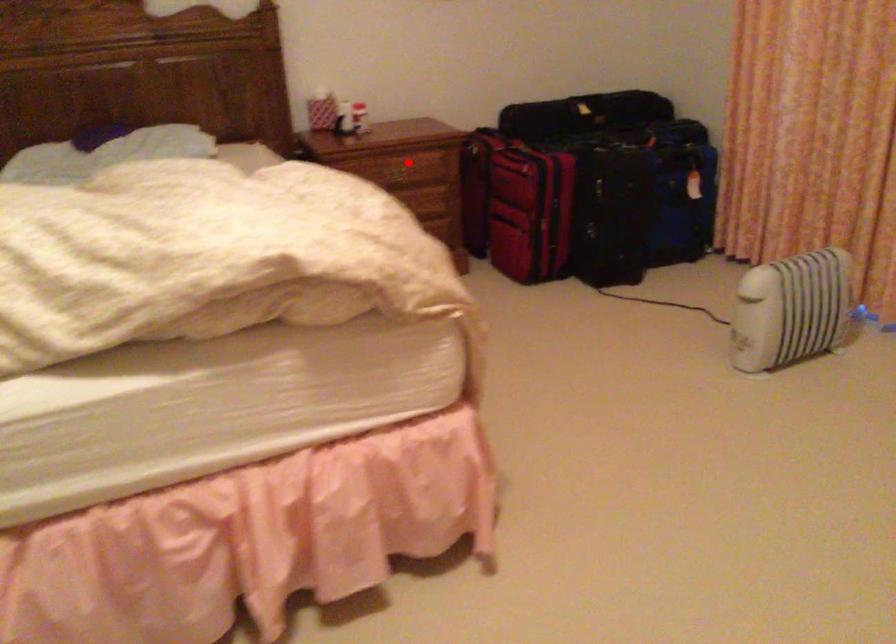
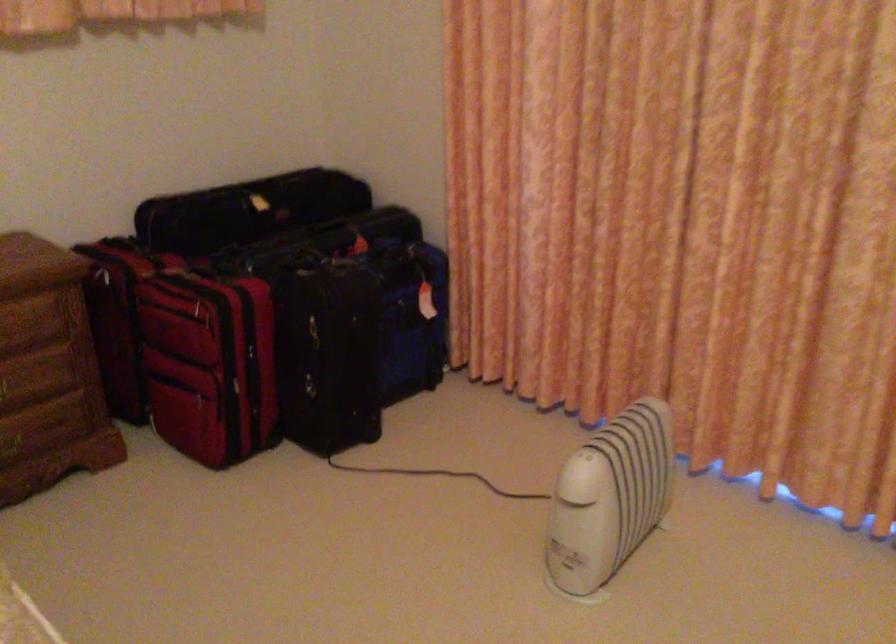
Question: I am providing you with two images of the same scene from different viewpoints. Given a red point in image1, look at the same physical point in image2. Is it:

Choices:
 (A) Closer to the viewpoint
 (B) Farther from the viewpoint

Answer: (A)